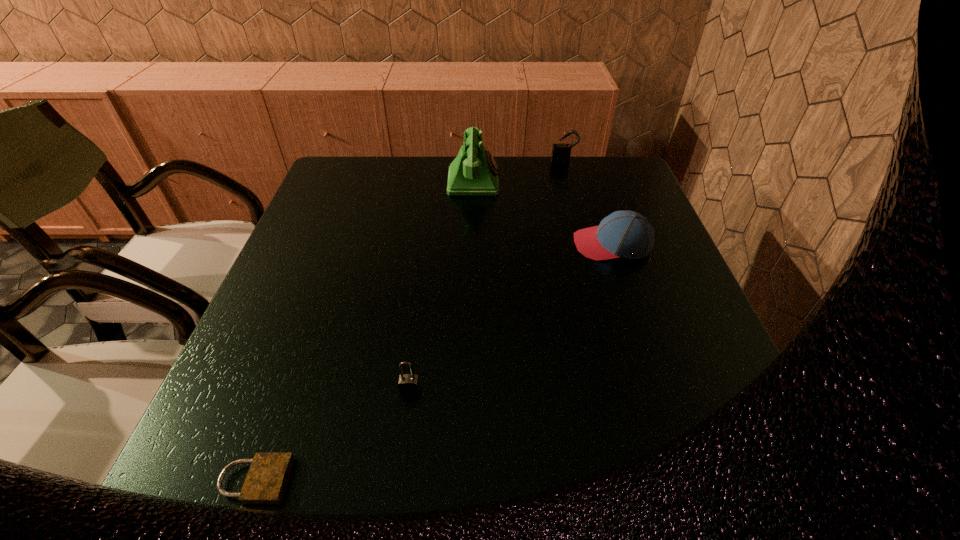
The image size is (960, 540). I want to click on padlock object that ranks as the second closest to the tallest padlock, so click(265, 483).

Select which padlock appears as the second closest to the third nearest object. Please provide its 2D coordinates. Your answer should be formatted as a tuple, i.e. [(x, y)], where the tuple contains the x and y coordinates of a point satisfying the conditions above.

[(409, 384)]

Where is `free region that satisfies the following two spatial constraints: 1. on the dial of the third object from left to right; 2. on the shackle of the second padlock from right to left`? This screenshot has height=540, width=960. free region that satisfies the following two spatial constraints: 1. on the dial of the third object from left to right; 2. on the shackle of the second padlock from right to left is located at coordinates (469, 389).

Image resolution: width=960 pixels, height=540 pixels. I want to click on blank space that satisfies the following two spatial constraints: 1. with the keyhole on the front of the farthest padlock; 2. on the keyhole side of the shortest object, so click(x=650, y=480).

At what (x,y) coordinates should I click in order to perform the action: click on free space that satisfies the following two spatial constraints: 1. on the front-facing side of the third nearest object; 2. on the shackle of the fourth object from right to left. Please return your answer as a coordinate pair (x, y). The image size is (960, 540). Looking at the image, I should click on (660, 389).

The image size is (960, 540). Find the location of `vacant region that satisfies the following two spatial constraints: 1. on the dial of the tallest object; 2. on the shackle of the second farthest padlock`. vacant region that satisfies the following two spatial constraints: 1. on the dial of the tallest object; 2. on the shackle of the second farthest padlock is located at coordinates (469, 389).

This screenshot has height=540, width=960. I want to click on free space that satisfies the following two spatial constraints: 1. on the dial of the tallest object; 2. on the shackle of the second padlock from right to left, so click(469, 389).

The height and width of the screenshot is (540, 960). I want to click on vacant point that satisfies the following two spatial constraints: 1. with the keyhole on the front of the tallest padlock; 2. on the keyhole side of the nearest padlock, so click(650, 480).